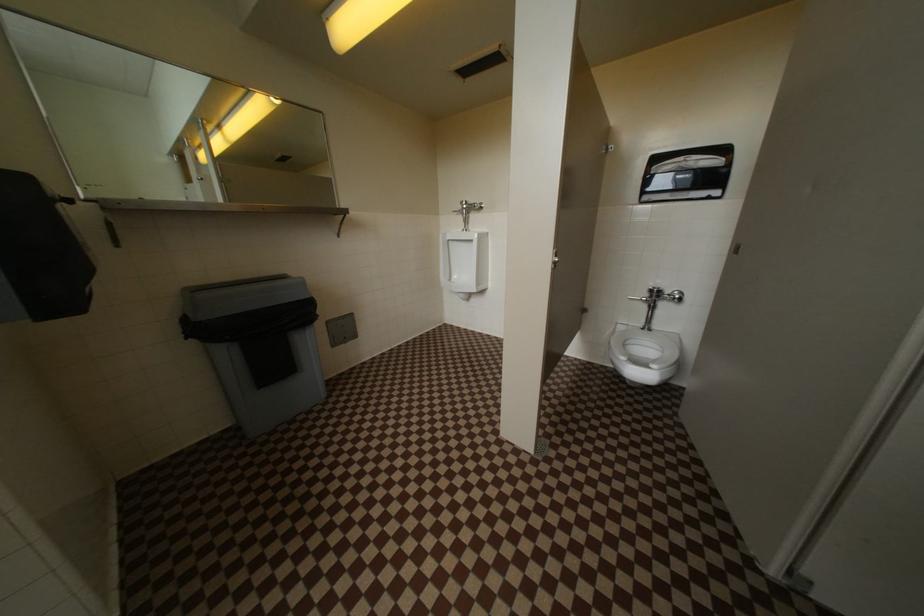
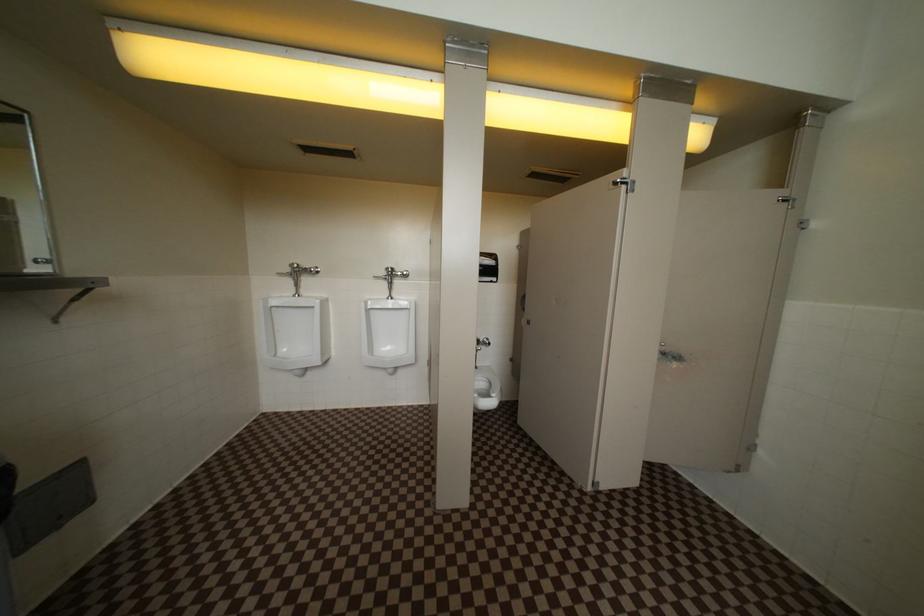
Question: The first image is from the beginning of the video and the second image is from the end. How did the camera likely rotate when shooting the video?

Choices:
 (A) Left
 (B) Right
 (C) Up
 (D) Down

Answer: (B)